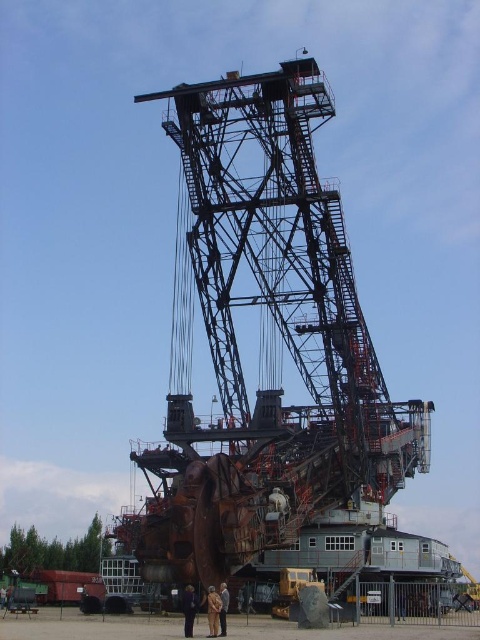
Can you confirm if brown leather jacket at center is taller than dark blue fabric coat at center?

No, brown leather jacket at center is not taller than dark blue fabric coat at center.

Between brown leather jacket at center and dark blue fabric coat at center, which one appears on the left side from the viewer's perspective?

From the viewer's perspective, dark blue fabric coat at center appears more on the left side.

Measure the distance between point (216, 600) and camera.

Point (216, 600) and camera are 121.14 meters apart.

Locate an element on the screen. The width and height of the screenshot is (480, 640). brown leather jacket at center is located at coordinates (213, 611).

Which is above, dark blue fabric coat at center or brown leather jacket at lower center?

dark blue fabric coat at center

Is dark blue fabric coat at center smaller than brown leather jacket at lower center?

No.

What do you see at coordinates (189, 609) in the screenshot? The height and width of the screenshot is (640, 480). I see `dark blue fabric coat at center` at bounding box center [189, 609].

The width and height of the screenshot is (480, 640). Identify the location of dark blue fabric coat at center. (189, 609).

Who is higher up, brown leather jacket at center or brown leather jacket at lower center?

brown leather jacket at center

Is brown leather jacket at center positioned behind brown leather jacket at lower center?

No.

Is point (215, 595) farther from viewer compared to point (227, 589)?

No, (215, 595) is closer to viewer.

The image size is (480, 640). I want to click on brown leather jacket at center, so click(x=213, y=611).